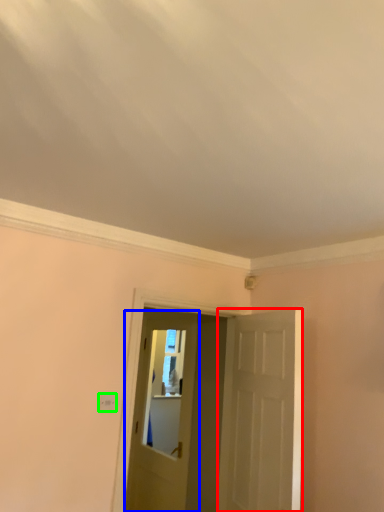
Question: Which is nearer to the door (highlighted by a red box)? door (highlighted by a blue box) or light switch (highlighted by a green box).

Choices:
 (A) door
 (B) light switch

Answer: (B)